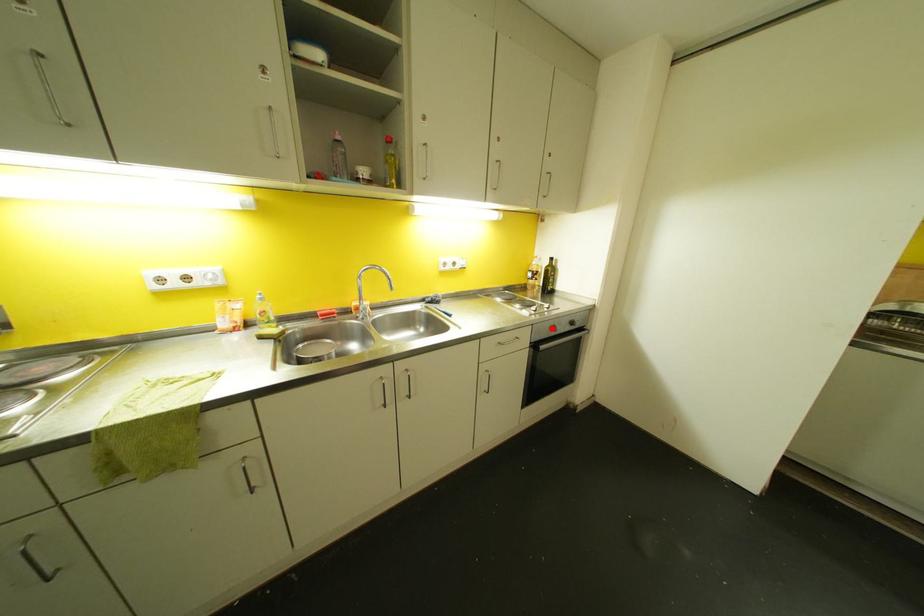
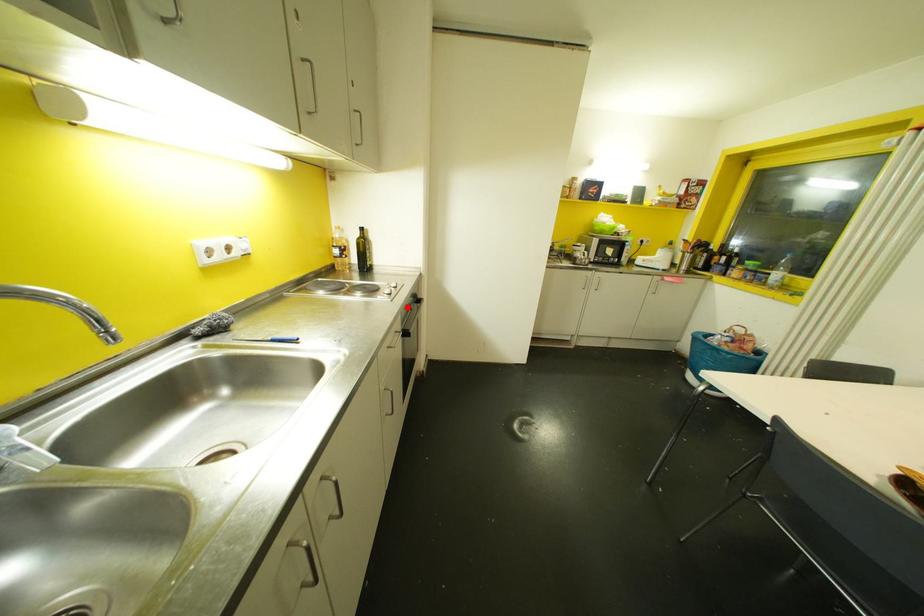
I am providing you with two images of the same scene from different viewpoints. A red point is marked on the first image and another point is marked on the second image. Do the highlighted points in image1 and image2 indicate the same real-world spot?

Yes